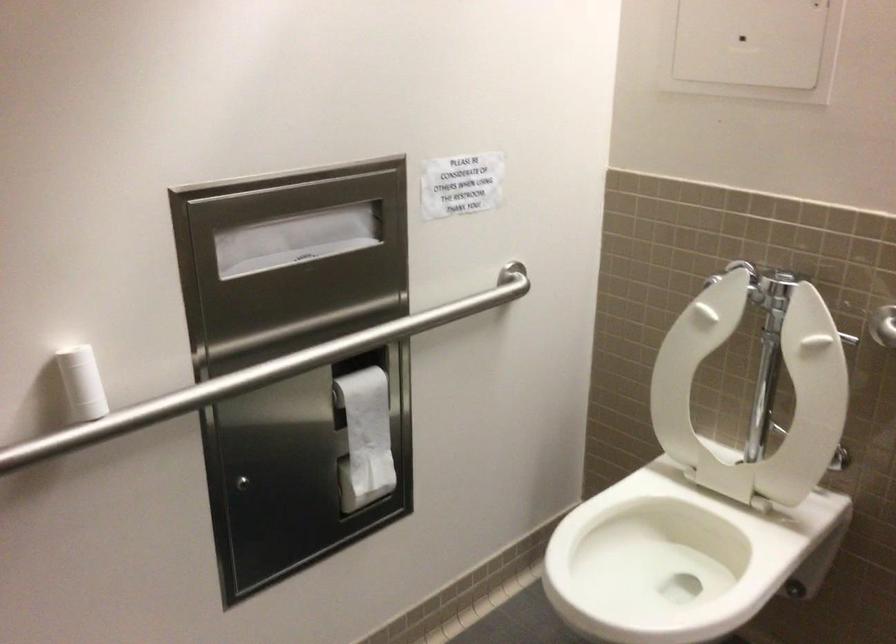
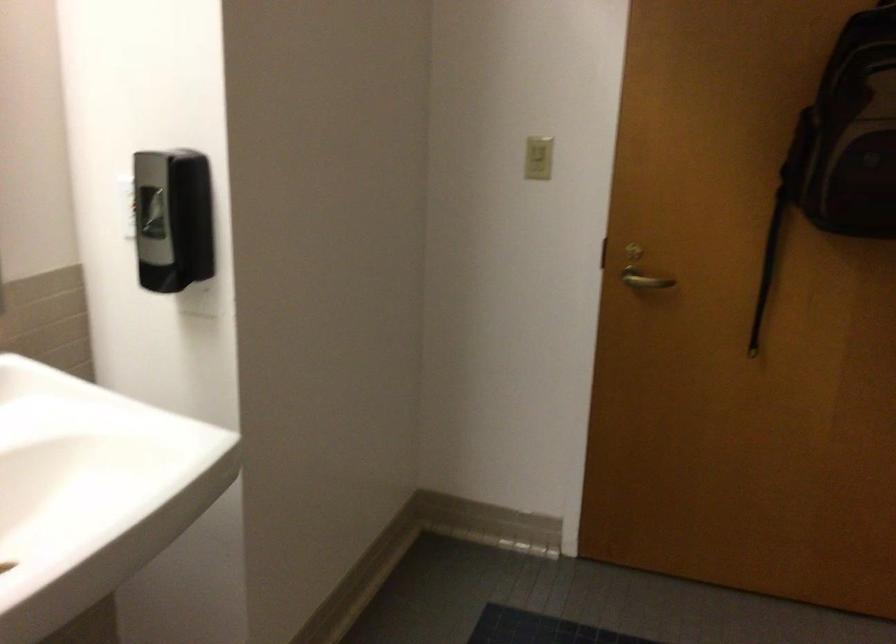
Based on the continuous images, in which direction is the camera rotating?

The rotation direction of the camera is right-down.